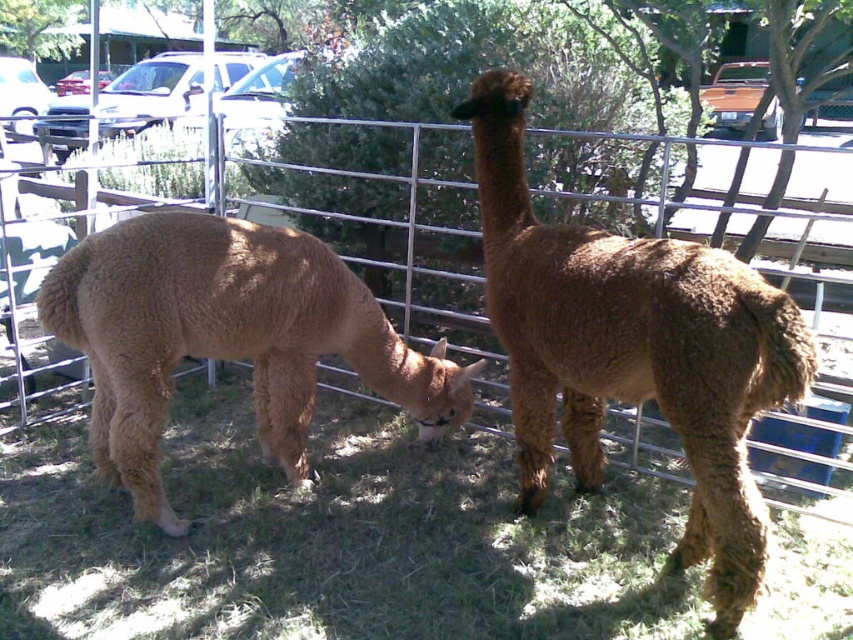
You are a farmer checking the enclosure for safety. You notice the brown woolly alpaca at center and the metallic silver fence at center. Based on their sizes, do you think the alpaca could potentially jump over the fence?

The brown woolly alpaca at center is taller than the metallic silver fence at center, so it is possible that the alpaca could jump over the fence.

Looking at this image, you are a farmer checking the enclosure for any potential hazards. You notice a point at coordinates (633, 349). Based on the scene, what object is located at this point?

The point at coordinates (633, 349) is located on the brown woolly alpaca at center.